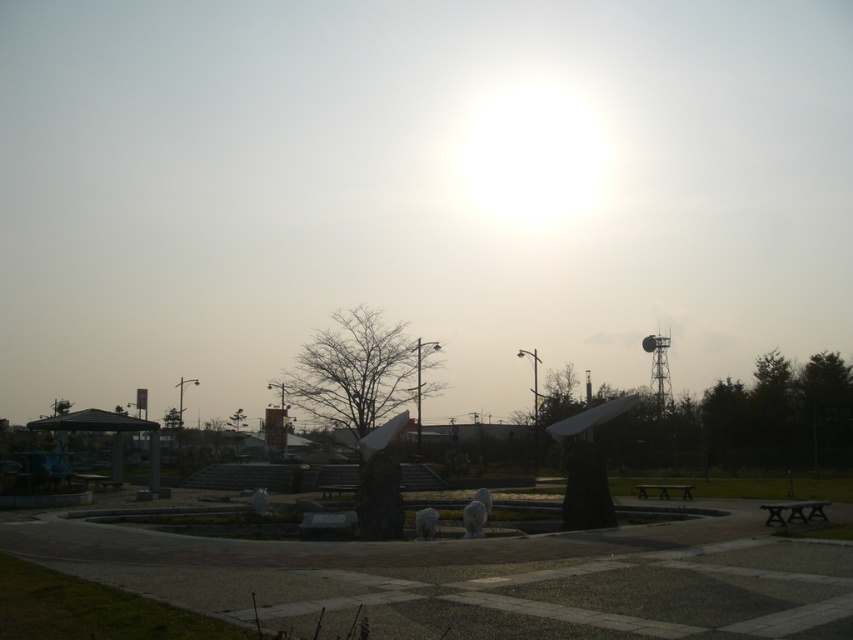
Question: Is dark brown wooden tree at center closer to camera compared to green matte tree at lower left?

Choices:
 (A) yes
 (B) no

Answer: (A)

Question: Which object is closer to the camera taking this photo?

Choices:
 (A) green matte tree at lower left
 (B) wooden bench at lower right
 (C) dark brown wooden bench at lower right

Answer: (C)

Question: Is dark brown wooden tree at center wider than dark brown wooden bench at lower right?

Choices:
 (A) no
 (B) yes

Answer: (B)

Question: Which object appears farthest from the camera in this image?

Choices:
 (A) dark brown wooden bench at lower right
 (B) green matte tree at lower left
 (C) dark brown wooden tree at center

Answer: (B)

Question: Is dark brown wooden bench at lower right closer to camera compared to green matte tree at lower left?

Choices:
 (A) yes
 (B) no

Answer: (A)

Question: Which point appears closest to the camera in this image?

Choices:
 (A) (55, 412)
 (B) (683, 493)
 (C) (339, 326)
 (D) (811, 502)

Answer: (D)